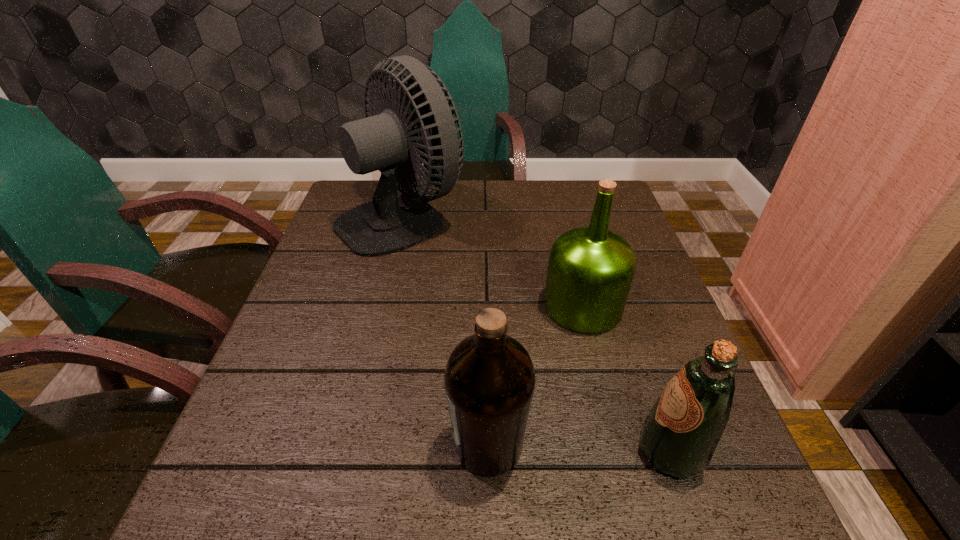
Identify the location of empty location between the shortest olive oil and the farthest olive oil. The width and height of the screenshot is (960, 540). (627, 378).

Where is `vacant point located between the leftmost olive oil and the tallest object`? Image resolution: width=960 pixels, height=540 pixels. vacant point located between the leftmost olive oil and the tallest object is located at coordinates (445, 331).

Point out which object is positioned as the nearest to the fan. Please provide its 2D coordinates. Your answer should be formatted as a tuple, i.e. [(x, y)], where the tuple contains the x and y coordinates of a point satisfying the conditions above.

[(590, 271)]

Select which object appears as the third closest to the farthest object. Please provide its 2D coordinates. Your answer should be formatted as a tuple, i.e. [(x, y)], where the tuple contains the x and y coordinates of a point satisfying the conditions above.

[(679, 436)]

Locate an element on the screen. olive oil identified as the closest to the shortest olive oil is located at coordinates click(x=489, y=379).

The width and height of the screenshot is (960, 540). I want to click on olive oil that stands as the closest to the fan, so click(x=590, y=271).

You are a GUI agent. You are given a task and a screenshot of the screen. Output one action in this format:
    pyautogui.click(x=<x>, y=<y>)
    Task: Click on the vacant position in the image that satisfies the following two spatial constraints: 1. in front of the farthest object to direct airflow; 2. on the back side of the farthest olive oil
    
    Given the screenshot: What is the action you would take?
    pyautogui.click(x=381, y=306)

Image resolution: width=960 pixels, height=540 pixels. Find the location of `vacant position in the image that satisfies the following two spatial constraints: 1. on the back side of the second farthest object; 2. in front of the farthest object to direct airflow`. vacant position in the image that satisfies the following two spatial constraints: 1. on the back side of the second farthest object; 2. in front of the farthest object to direct airflow is located at coordinates (561, 217).

This screenshot has width=960, height=540. I want to click on blank space that satisfies the following two spatial constraints: 1. in front of the farthest object to direct airflow; 2. on the right side of the third nearest object, so click(x=381, y=306).

Find the location of `free spot that satisfies the following two spatial constraints: 1. in front of the farthest object to direct airflow; 2. on the left side of the farthest olive oil`. free spot that satisfies the following two spatial constraints: 1. in front of the farthest object to direct airflow; 2. on the left side of the farthest olive oil is located at coordinates (381, 306).